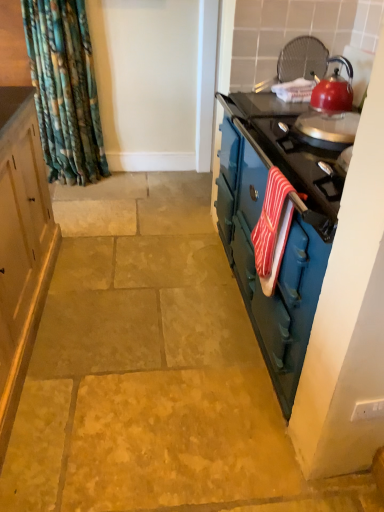
Find the location of `red striped towel at right`. red striped towel at right is located at coordinates (273, 229).

In order to face red striped towel at right, should I rotate leftwards or rightwards?

Rotate right and turn 10.252 degrees.

This screenshot has height=512, width=384. Identify the location of teal glossy dresser at right. (286, 244).

From a real-world perspective, relative to teal glossy dresser at right, is red striped towel at right vertically above or below?

From a real-world perspective, red striped towel at right is physically above teal glossy dresser at right.

Can you confirm if red striped towel at right is thinner than teal glossy dresser at right?

Indeed, red striped towel at right has a lesser width compared to teal glossy dresser at right.

Is teal glossy dresser at right located within red striped towel at right?

No, teal glossy dresser at right is located outside of red striped towel at right.

Is the surface of red striped towel at right in direct contact with teal glossy dresser at right?

They are not placed beside each other.

Which point is more forward, (337, 98) or (267, 191)?

The point (267, 191) is closer to the camera.

Is shiny red kettle at upper right placed right next to red striped towel at right?

No, shiny red kettle at upper right is not next to red striped towel at right.

From a real-world perspective, who is located lower, shiny red kettle at upper right or red striped towel at right?

From a 3D spatial view, red striped towel at right is below.

From the image's perspective, is shiny red kettle at upper right positioned above or below red striped towel at right?

shiny red kettle at upper right is situated higher than red striped towel at right in the image.

Can you tell me how much teal glossy dresser at right and shiny red kettle at upper right differ in facing direction?

The facing directions of teal glossy dresser at right and shiny red kettle at upper right are 0.292 degrees apart.

In terms of height, does teal glossy dresser at right look taller or shorter compared to shiny red kettle at upper right?

Clearly, teal glossy dresser at right is taller compared to shiny red kettle at upper right.

Between teal glossy dresser at right and shiny red kettle at upper right, which one appears on the left side from the viewer's perspective?

teal glossy dresser at right is more to the left.

Who is shorter, shiny red kettle at upper right or teal glossy dresser at right?

shiny red kettle at upper right.

From the image's perspective, which is below, shiny red kettle at upper right or teal glossy dresser at right?

teal glossy dresser at right appears lower in the image.

From a real-world perspective, is shiny red kettle at upper right over teal glossy dresser at right?

Correct, in the physical world, shiny red kettle at upper right is higher than teal glossy dresser at right.

Is shiny red kettle at upper right wider than teal glossy dresser at right?

No.

Would you say red striped towel at right is a long distance from shiny red kettle at upper right?

Actually, red striped towel at right and shiny red kettle at upper right are a little close together.

What's the angular difference between red striped towel at right and shiny red kettle at upper right's facing directions?

red striped towel at right and shiny red kettle at upper right are facing 0.00684 degrees away from each other.

Considering the positions of objects red striped towel at right and shiny red kettle at upper right in the image provided, who is in front, red striped towel at right or shiny red kettle at upper right?

red striped towel at right.

From a real-world perspective, does teal glossy dresser at right stand above red striped towel at right?

Actually, teal glossy dresser at right is physically below red striped towel at right in the real world.

Which object is closer to the camera taking this photo, teal glossy dresser at right or red striped towel at right?

Positioned in front is teal glossy dresser at right.

Who is taller, teal glossy dresser at right or red striped towel at right?

Standing taller between the two is teal glossy dresser at right.

Are teal glossy dresser at right and red striped towel at right making contact?

No, teal glossy dresser at right is not making contact with red striped towel at right.

I want to click on beach towel above the teal glossy dresser at right (from a real-world perspective), so click(x=273, y=229).

The height and width of the screenshot is (512, 384). I want to click on beach towel that is under the shiny red kettle at upper right (from a real-world perspective), so click(x=273, y=229).

Which object lies nearer to the anchor point red striped towel at right, shiny red kettle at upper right or teal glossy dresser at right?

teal glossy dresser at right is closer to red striped towel at right.

Based on their spatial positions, is shiny red kettle at upper right or red striped towel at right further from teal glossy dresser at right?

The object further to teal glossy dresser at right is shiny red kettle at upper right.

From the image, which object appears to be farther from shiny red kettle at upper right, red striped towel at right or teal glossy dresser at right?

Based on the image, red striped towel at right appears to be further to shiny red kettle at upper right.

Considering their positions, is teal glossy dresser at right positioned further to red striped towel at right than shiny red kettle at upper right?

shiny red kettle at upper right.

From the image, which object appears to be farther from teal glossy dresser at right, red striped towel at right or shiny red kettle at upper right?

Based on the image, shiny red kettle at upper right appears to be further to teal glossy dresser at right.

From the image, which object appears to be nearer to shiny red kettle at upper right, teal glossy dresser at right or red striped towel at right?

Based on the image, teal glossy dresser at right appears to be nearer to shiny red kettle at upper right.

Image resolution: width=384 pixels, height=512 pixels. In order to click on dresser between shiny red kettle at upper right and red striped towel at right vertically in this screenshot , I will do `click(286, 244)`.